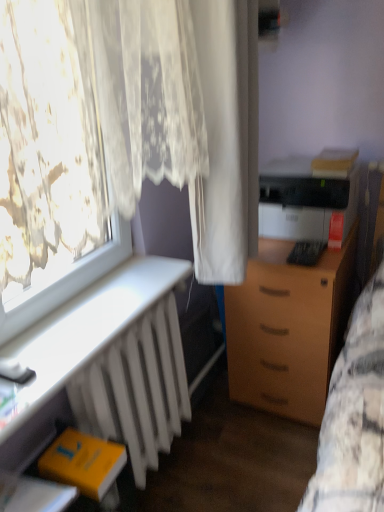
Question: In the image, is white matte radiator at lower left on the left side or the right side of wooden drawer at center-right?

Choices:
 (A) right
 (B) left

Answer: (B)

Question: Is white matte radiator at lower left wider or thinner than wooden drawer at center-right?

Choices:
 (A) wide
 (B) thin

Answer: (B)

Question: Estimate the real-world distances between objects in this image. Which object is closer to the wooden drawer at center-right?

Choices:
 (A) white matte radiator at lower left
 (B) black plastic printer at right
 (C) yellow matte book at lower left
 (D) white sheer curtain at center

Answer: (B)

Question: Based on their relative distances, which object is farther from the wooden drawer at center-right?

Choices:
 (A) white sheer curtain at center
 (B) black plastic printer at right
 (C) white matte radiator at lower left
 (D) yellow matte book at lower left

Answer: (D)